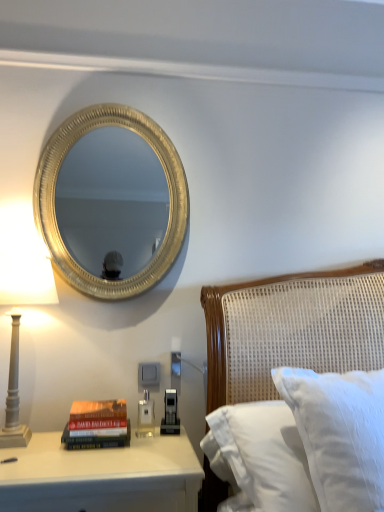
Question: Does point (82, 426) appear closer or farther from the camera than point (153, 473)?

Choices:
 (A) farther
 (B) closer

Answer: (A)

Question: In terms of height, does hardcover book at lower left look taller or shorter compared to white glossy nightstand at lower left?

Choices:
 (A) short
 (B) tall

Answer: (A)

Question: Considering the real-world distances, which object is farthest from the gray columnar lamp at left?

Choices:
 (A) hardcover book at lower left
 (B) white glossy nightstand at lower left
 (C) gold textured mirror at upper left
 (D) white textured pillow at right

Answer: (C)

Question: Which object is positioned farthest from the gold textured mirror at upper left?

Choices:
 (A) white textured pillow at right
 (B) hardcover book at lower left
 (C) gray columnar lamp at left
 (D) white glossy nightstand at lower left

Answer: (C)